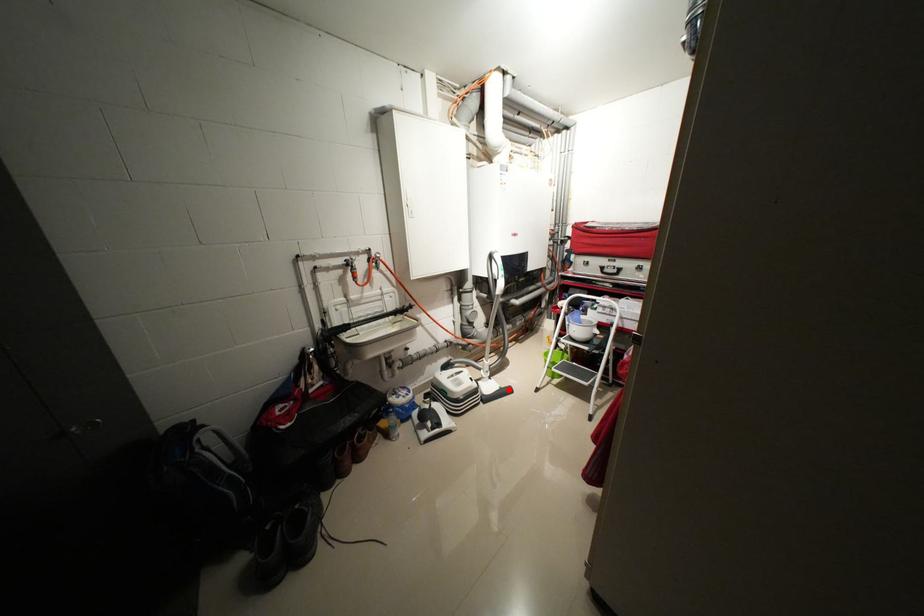
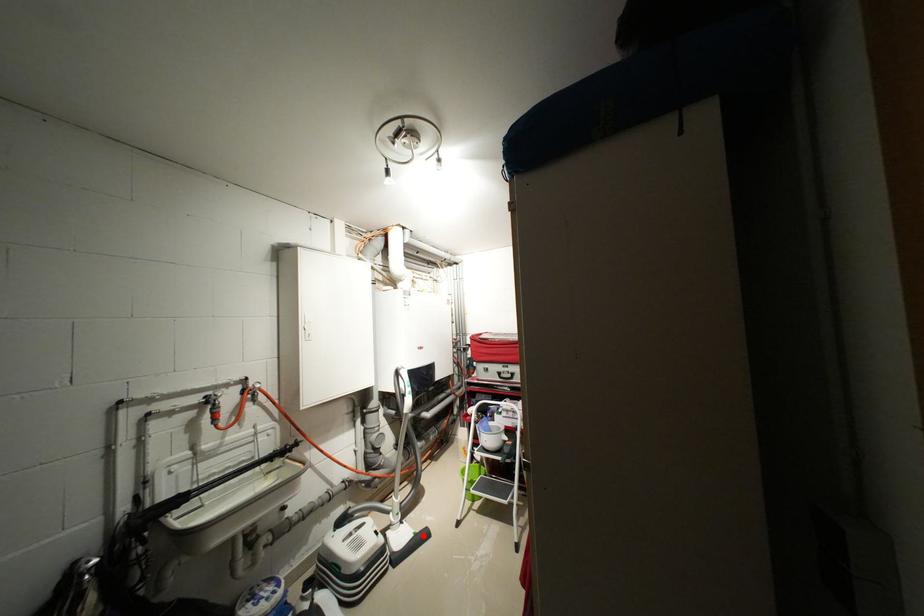
I am providing you with two images of the same scene from different viewpoints. A red point is marked on the first image and another point is marked on the second image. Does the point marked in image1 correspond to the same location as the one in image2?

Yes